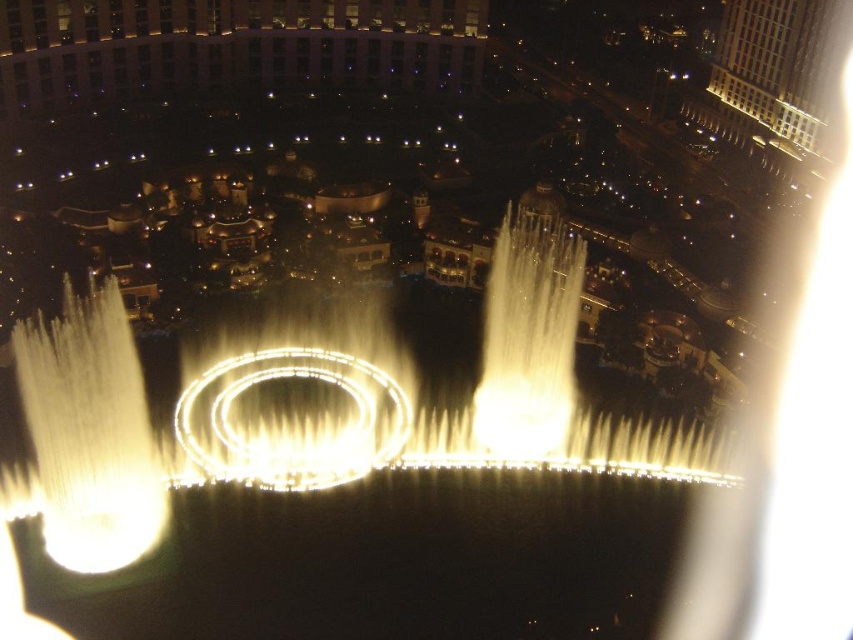
Does beige stone building at upper center appear on the right side of white marble building at upper right?

Incorrect, beige stone building at upper center is not on the right side of white marble building at upper right.

Does point (108, 77) come in front of point (816, 48)?

No, it is not.

Describe the element at coordinates (231, 48) in the screenshot. I see `beige stone building at upper center` at that location.

Identify the location of beige stone building at upper center. The width and height of the screenshot is (853, 640). (231, 48).